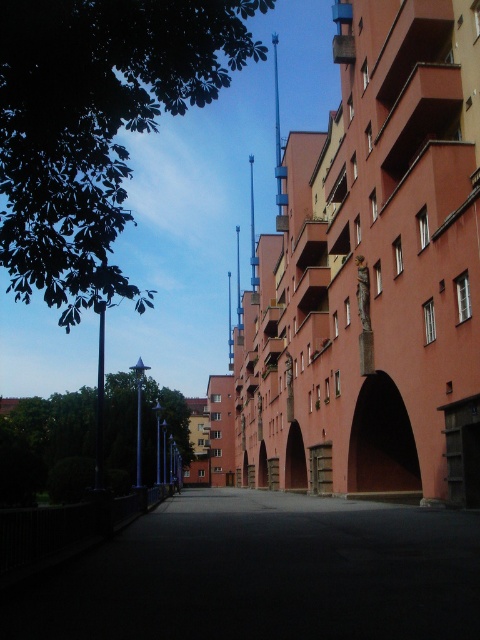
You are standing on the pedestrian walkway and want to take a photo of the dark matte archway at center without any obstructions. Is the green leafy tree at upper left blocking your view of the archway?

The green leafy tree at upper left is in front of the dark matte archway at center, so it would block the view of the archway. To take an unobstructed photo, you would need to move to a position where the tree is no longer between you and the archway.

Based on the photo, you are standing at the center of the walkway and want to look towards the green leafy tree at upper left. In which direction should you turn your head?

You should turn your head to the upper left to look towards the green leafy tree at upper left, as its 2D location is at point (96, 125).